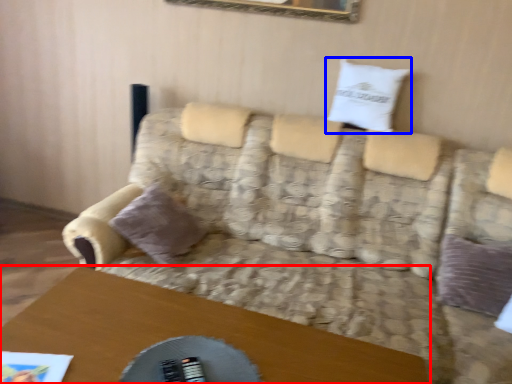
Question: Which of the following is the farthest to the observer, table (highlighted by a red box) or pillow (highlighted by a blue box)?

Choices:
 (A) table
 (B) pillow

Answer: (B)